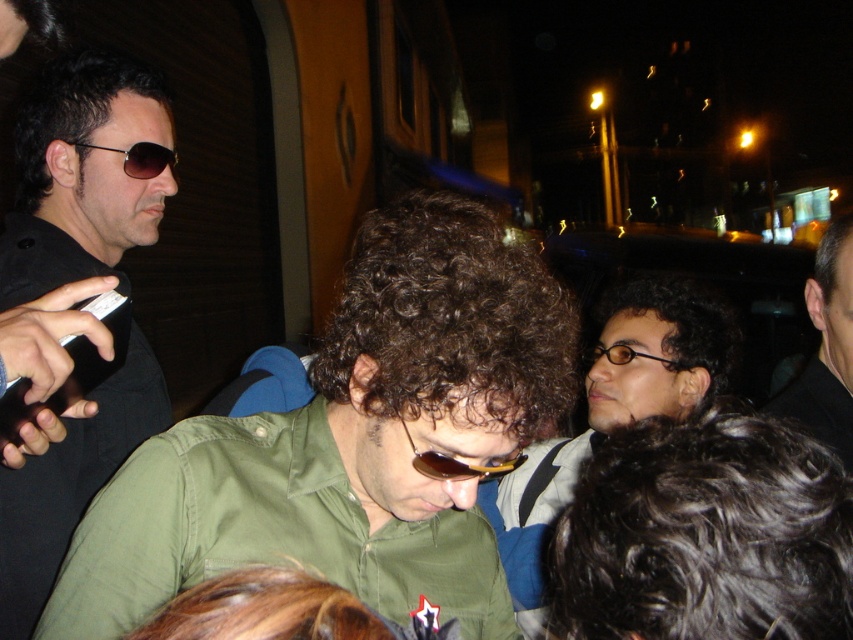
You are a photographer trying to capture a clear shot of the sunglasses at center and the matte black sunglasses at upper left. Which sunglasses will be more visible in your photo due to their position?

The sunglasses at center will be more visible in the photo because they are in front of the matte black sunglasses at upper left.

You are an artist trying to sketch this scene. You need to place the matte black hair at center accurately on your canvas. According to the coordinates given, where should you position it?

The matte black hair at center should be placed at the coordinates point 0.644 on the x axis and 0.719 on the y axis.